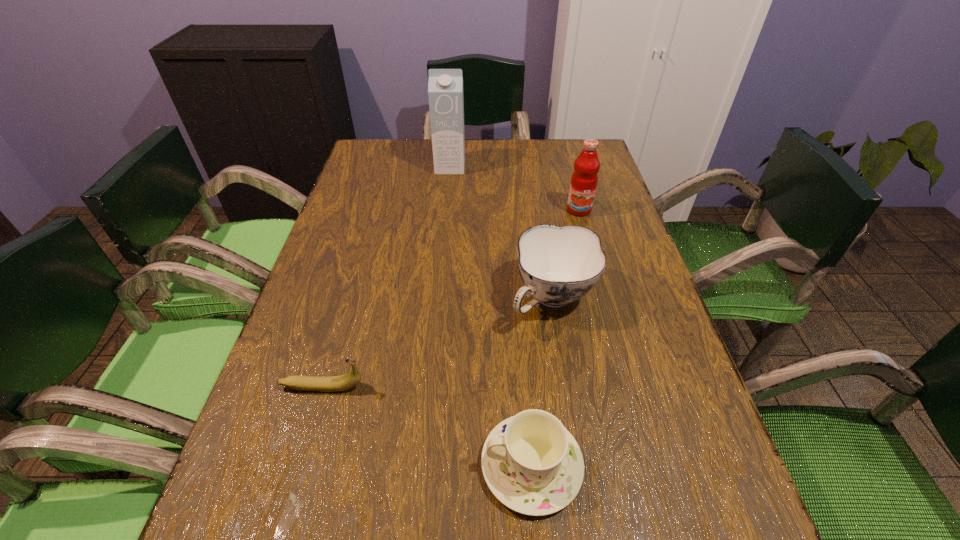
The height and width of the screenshot is (540, 960). I want to click on free space between the third nearest object and the nearer chinaware, so click(x=541, y=382).

What are the coordinates of `free space between the banana and the nearest object` in the screenshot? It's located at (427, 426).

I want to click on free space between the banana and the shorter chinaware, so click(x=427, y=426).

Identify the location of vacant point located between the fourth farthest object and the farther chinaware. (438, 343).

Where is `free space between the tallest object and the fourth farthest object`? The height and width of the screenshot is (540, 960). free space between the tallest object and the fourth farthest object is located at coordinates (387, 277).

Locate which object ranks third in proximity to the fourth farthest object. Please provide its 2D coordinates. Your answer should be formatted as a tuple, i.e. [(x, y)], where the tuple contains the x and y coordinates of a point satisfying the conditions above.

[(584, 179)]

Locate an element on the screen. object that stands as the fourth closest to the fruit juice is located at coordinates (347, 381).

Identify the location of free region that satisfies the following two spatial constraints: 1. on the front label of the fruit juice; 2. on the handle side of the nearest object. (649, 465).

Find the location of a particular element. Image resolution: width=960 pixels, height=540 pixels. vacant area in the image that satisfies the following two spatial constraints: 1. on the front label of the fruit juice; 2. on the handle side of the shorter chinaware is located at coordinates (649, 465).

Where is `free spot that satisfies the following two spatial constraints: 1. on the front label of the fourth object from right to left; 2. at the stem of the banana`? This screenshot has width=960, height=540. free spot that satisfies the following two spatial constraints: 1. on the front label of the fourth object from right to left; 2. at the stem of the banana is located at coordinates (429, 387).